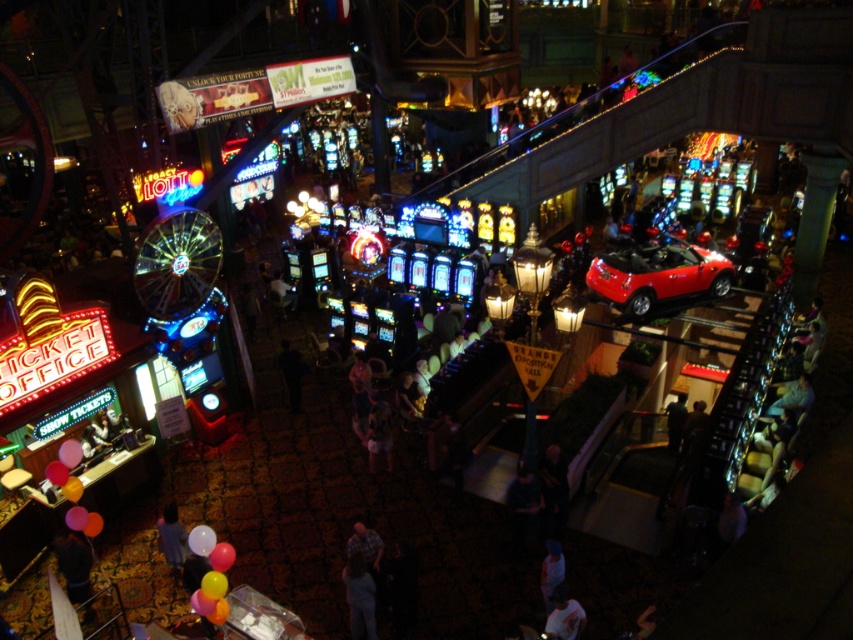
Consider the image. Who is positioned more to the left, rubber balloon at lower center or rubber balloons at lower left?

Positioned to the left is rubber balloons at lower left.

Who is positioned more to the right, rubber balloon at lower center or rubber balloons at lower left?

From the viewer's perspective, rubber balloon at lower center appears more on the right side.

What do you see at coordinates (221, 556) in the screenshot? I see `rubber balloon at lower center` at bounding box center [221, 556].

This screenshot has width=853, height=640. Find the location of `rubber balloon at lower center`. rubber balloon at lower center is located at coordinates tap(221, 556).

Between point (196, 547) and point (219, 541), which one is positioned behind?

The point (219, 541) is more distant.

Based on the photo, measure the distance between translucent rubber balloon at lower left and camera.

translucent rubber balloon at lower left is 11.98 meters away from camera.

Locate an element on the screen. translucent rubber balloon at lower left is located at coordinates (201, 540).

Is shiny red convertible at center below translucent rubber balloon at lower left?

Actually, shiny red convertible at center is above translucent rubber balloon at lower left.

Does shiny red convertible at center have a greater height compared to translucent rubber balloon at lower left?

Correct, shiny red convertible at center is much taller as translucent rubber balloon at lower left.

Measure the distance between point (699, 269) and camera.

Point (699, 269) and camera are 66.11 feet apart.

Identify the location of shiny red convertible at center. The height and width of the screenshot is (640, 853). (659, 275).